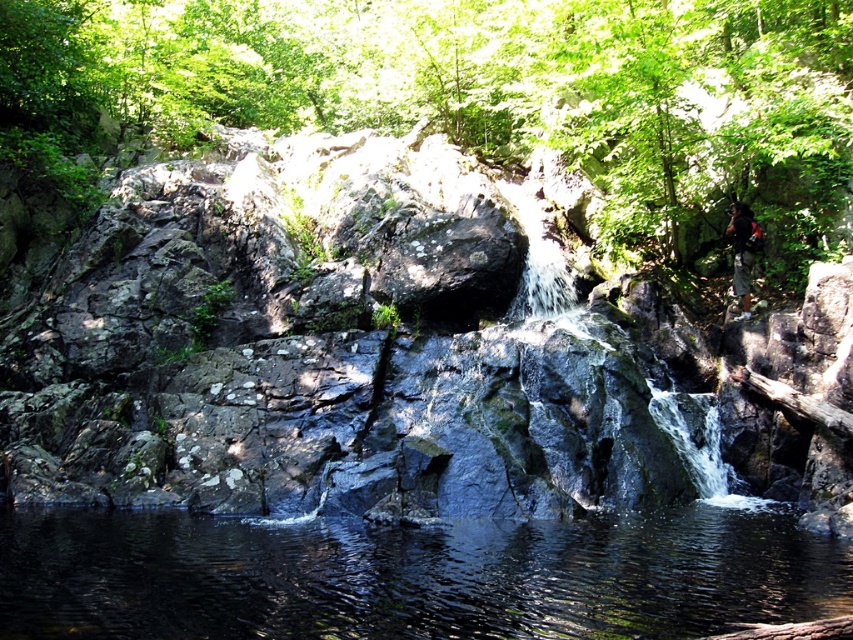
Question: Which point is farther to the camera?

Choices:
 (A) clear water at center
 (B) dark brown leather backpack at right

Answer: (B)

Question: Does clear water at center appear on the right side of dark brown leather backpack at right?

Choices:
 (A) no
 (B) yes

Answer: (A)

Question: Is clear water at center thinner than dark brown leather backpack at right?

Choices:
 (A) no
 (B) yes

Answer: (A)

Question: Can you confirm if clear water at center is positioned below dark brown leather backpack at right?

Choices:
 (A) no
 (B) yes

Answer: (B)